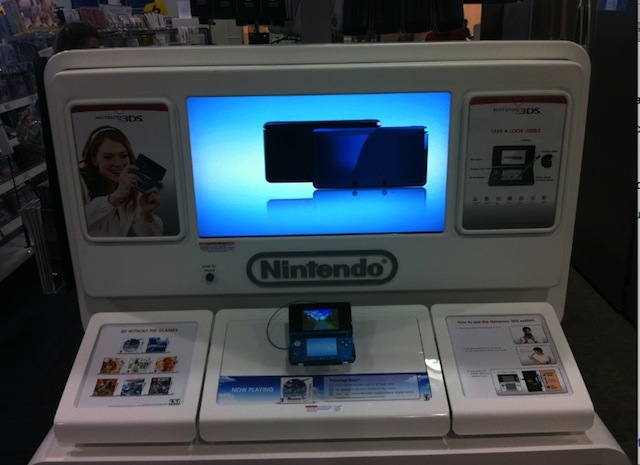
The image size is (640, 465). Find the location of `screen display`. screen display is located at coordinates (353, 159).